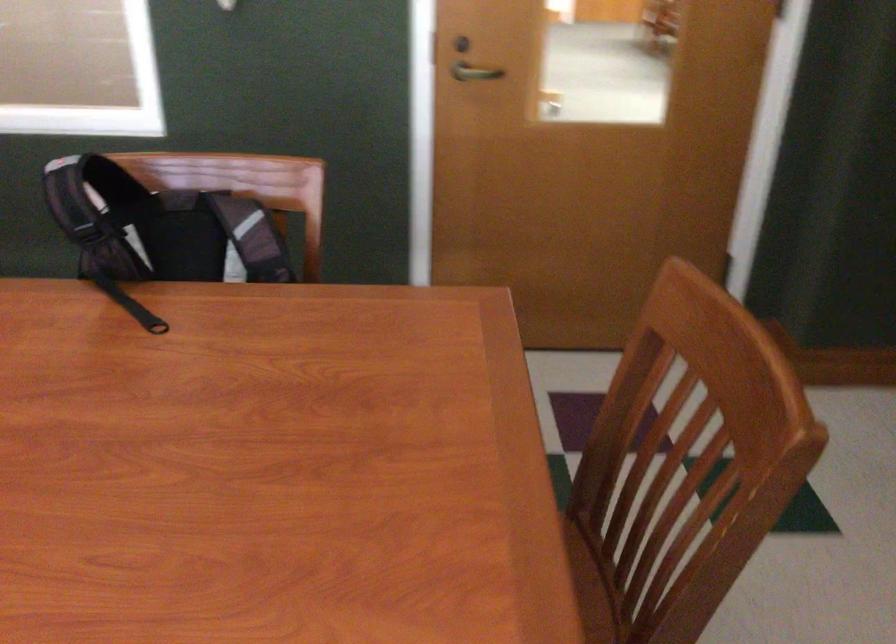
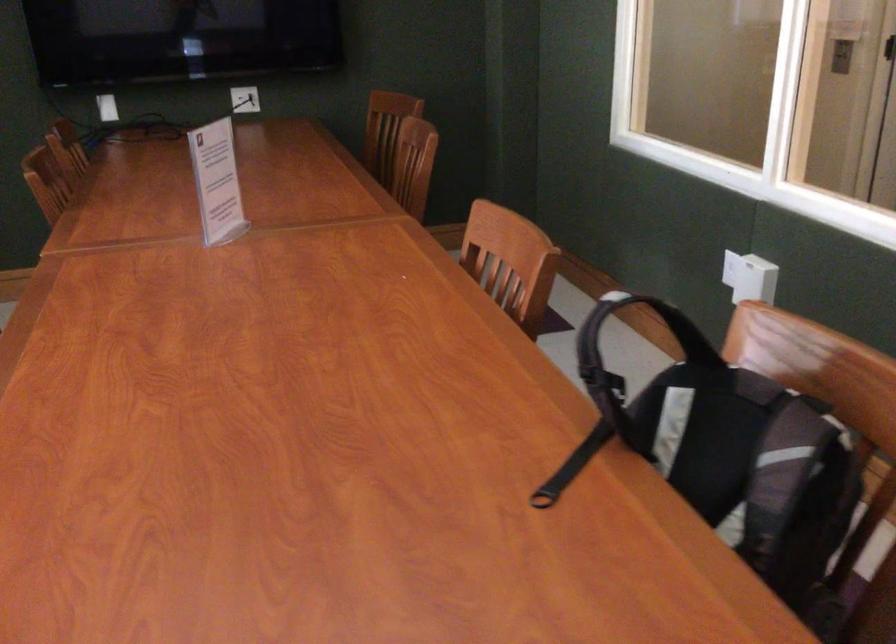
Locate, in the second image, the point that corresponds to (x=255, y=223) in the first image.

(796, 456)